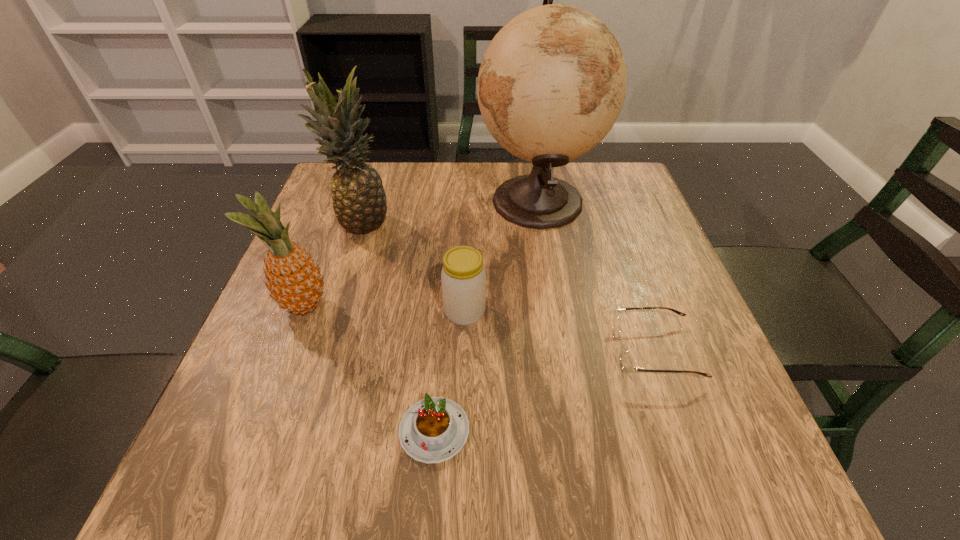
Find the location of a particular element. unoccupied position between the third shortest object and the farther pineapple is located at coordinates (x=414, y=267).

Where is `vacant space in between the fourth shortest object and the shortest object`? The image size is (960, 540). vacant space in between the fourth shortest object and the shortest object is located at coordinates (369, 368).

I want to click on object identified as the fifth closest to the globe, so click(x=433, y=430).

Image resolution: width=960 pixels, height=540 pixels. In order to click on object that stands as the fourth closest to the shorter pineapple in this screenshot , I will do `click(552, 83)`.

The height and width of the screenshot is (540, 960). Identify the location of vacant space that satisfies the following two spatial constraints: 1. on the front side of the farther pineapple; 2. on the right side of the nearest object. (296, 431).

I want to click on vacant region that satisfies the following two spatial constraints: 1. on the front-facing side of the spectacles; 2. on the front side of the nearest object, so click(x=683, y=431).

Find the location of a particular element. vacant space that satisfies the following two spatial constraints: 1. on the front-facing side of the tallest object; 2. on the front side of the farther pineapple is located at coordinates (540, 222).

This screenshot has width=960, height=540. What are the coordinates of `vacant space that satisfies the following two spatial constraints: 1. on the front-facing side of the tallest object; 2. on the front side of the second tallest object` in the screenshot? It's located at (540, 222).